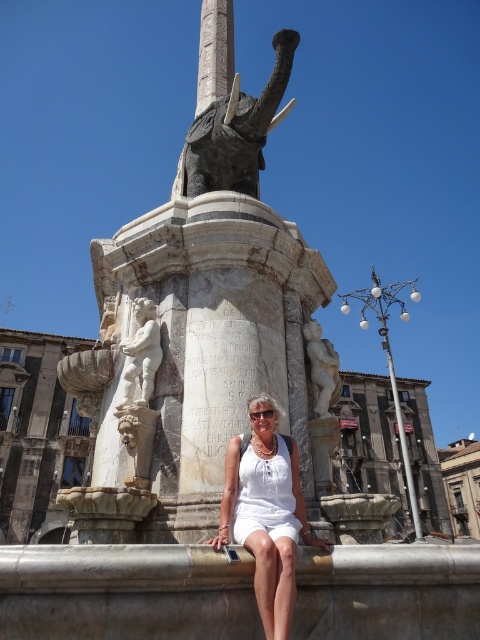
Question: Which object is the farthest from the white marble cherub at center?

Choices:
 (A) white marble cherub at lower left
 (B) polished stone elephant at center
 (C) white fabric at center
 (D) bronze elephant at upper center

Answer: (D)

Question: Among these objects, which one is farthest from the camera?

Choices:
 (A) white fabric at center
 (B) white marble cherub at lower left
 (C) bronze elephant at upper center

Answer: (C)

Question: Can you confirm if bronze elephant at upper center is positioned above white marble cherub at center?

Choices:
 (A) yes
 (B) no

Answer: (A)

Question: Does polished stone elephant at center appear on the right side of bronze elephant at upper center?

Choices:
 (A) no
 (B) yes

Answer: (A)

Question: Is the position of white fabric at center more distant than that of white marble cherub at center?

Choices:
 (A) yes
 (B) no

Answer: (B)

Question: Based on their relative distances, which object is nearer to the polished stone elephant at center?

Choices:
 (A) white marble cherub at lower left
 (B) white fabric at center

Answer: (A)